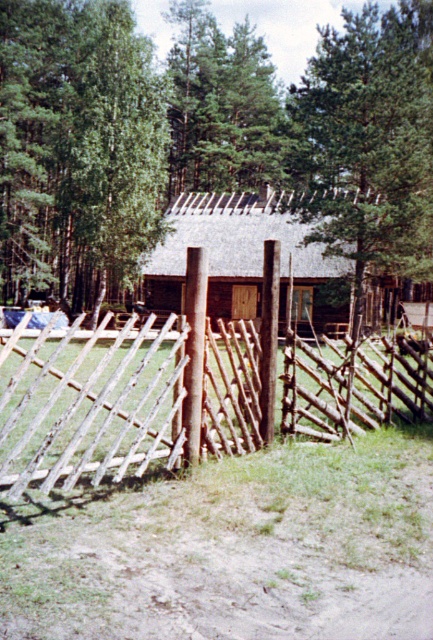
You are standing in front of the brown wooden log cabin at center and want to walk towards the green matte tree at upper center. In which direction should you head?

You should head to the left because the green matte tree at upper center is located to the left of the brown wooden log cabin at center.

You are standing in front of the rustic wooden cabin and looking at the wooden fence with two points marked on it. Which point, point (225, 332) or point (151, 304), is closer to you?

Point (225, 332) is closer to the camera than point (151, 304).

You are standing at the entrance of the rustic wooden cabin and want to walk straight towards the rustic wooden gate at center. Which direction should you move relative to the cabin?

Since the rustic wooden gate at center is positioned at point 0.617 on the x axis and 0.307 on the y axis, you should move forward in the direction of the gate as it is located directly ahead of the cabin entrance.